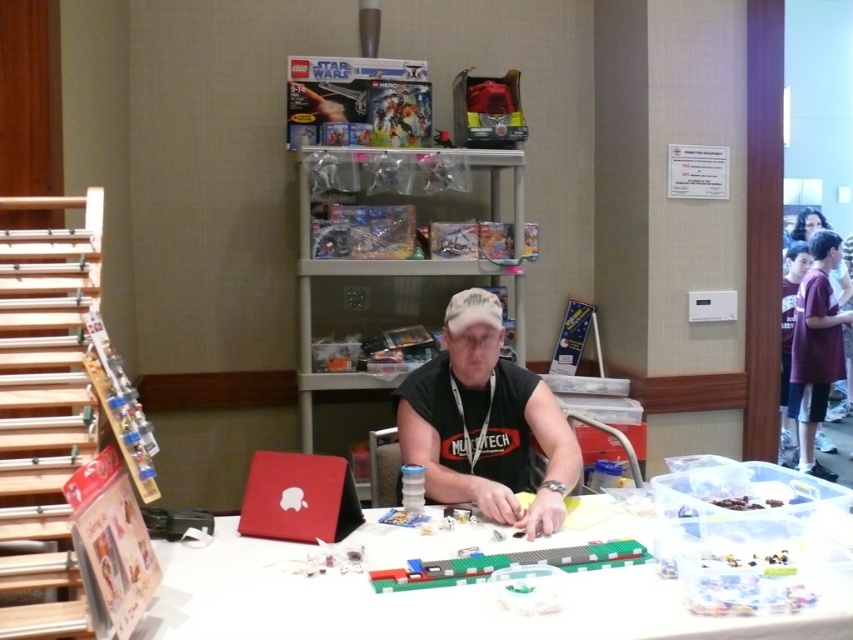
Question: In this image, where is black matte shirt at center located relative to black hair at upper right?

Choices:
 (A) below
 (B) above

Answer: (A)

Question: Estimate the real-world distances between objects in this image. Which object is closer to the matte red laptop at center?

Choices:
 (A) black hair at upper right
 (B) black matte shirt at center

Answer: (B)

Question: Considering the relative positions of black matte shirt at center and black hair at upper right in the image provided, where is black matte shirt at center located with respect to black hair at upper right?

Choices:
 (A) below
 (B) above

Answer: (A)

Question: Which of these objects is positioned farthest from the black hair at upper right?

Choices:
 (A) matte red laptop at center
 (B) black matte shirt at center
 (C) white plastic table at center

Answer: (A)

Question: Can you confirm if black matte shirt at center is positioned to the left of black hair at upper right?

Choices:
 (A) yes
 (B) no

Answer: (A)

Question: Among these points, which one is nearest to the camera?

Choices:
 (A) (485, 589)
 (B) (259, 468)

Answer: (A)